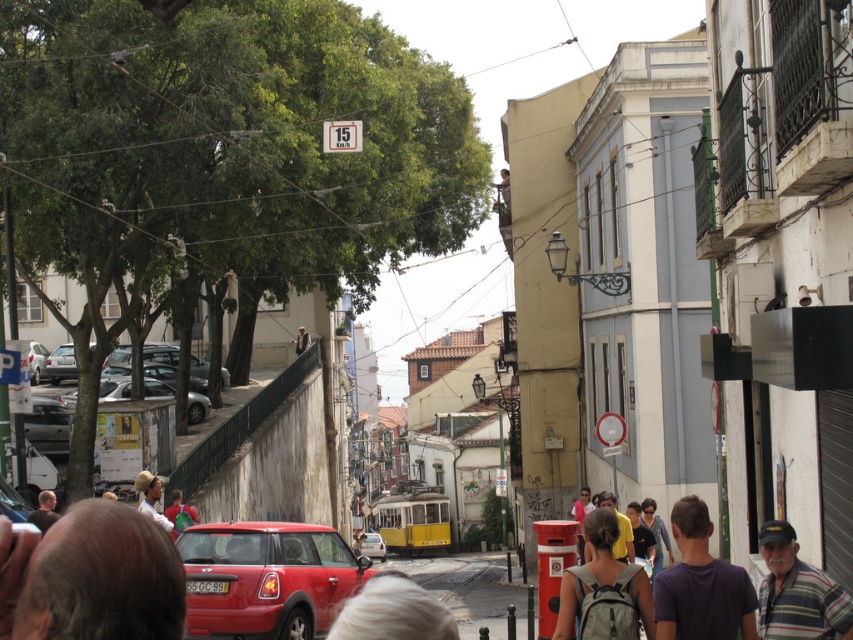
Consider the image. You are standing at the entrance of the street and want to find the shiny silver car at center. According to the coordinates given, where should you look relative to your position?

The shiny silver car at center is located at coordinates 0.581 on the x axis and 0.189 on the y axis relative to your position at the entrance.